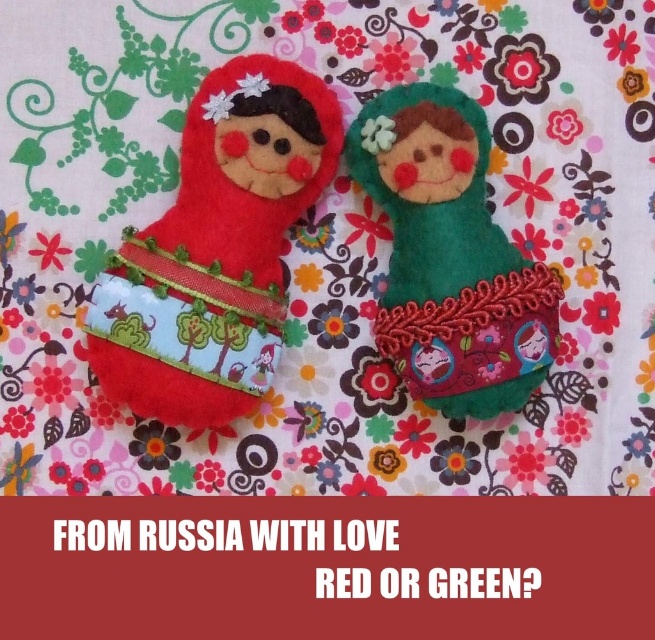
Question: Is matte felt doll at left wider than green felt doll at center?

Choices:
 (A) no
 (B) yes

Answer: (B)

Question: Which point is closer to the camera taking this photo?

Choices:
 (A) (246, 172)
 (B) (455, 161)

Answer: (A)

Question: Is matte felt doll at left further to camera compared to green felt doll at center?

Choices:
 (A) no
 (B) yes

Answer: (A)

Question: Is matte felt doll at left below green felt doll at center?

Choices:
 (A) no
 (B) yes

Answer: (A)